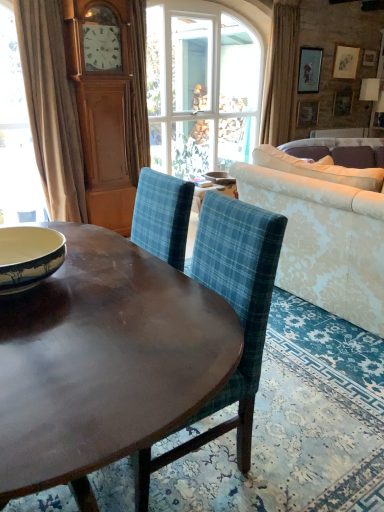
Where is `vacant area located to the right-hand side of blue and white ceramic bowl at left, marked as the 2th bowl in a back-to-front arrangement`? vacant area located to the right-hand side of blue and white ceramic bowl at left, marked as the 2th bowl in a back-to-front arrangement is located at coordinates (113, 282).